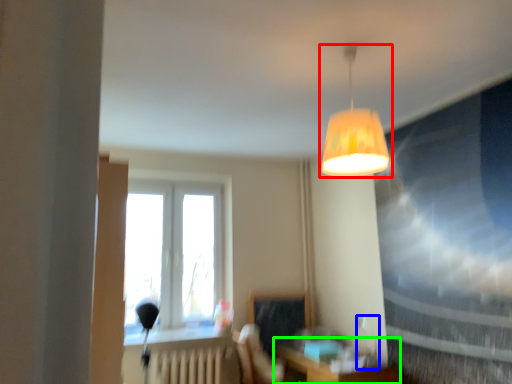
Question: Considering the real-world distances, which object is farthest from lamp (highlighted by a red box)? table lamp (highlighted by a blue box) or table (highlighted by a green box)?

Choices:
 (A) table lamp
 (B) table

Answer: (A)